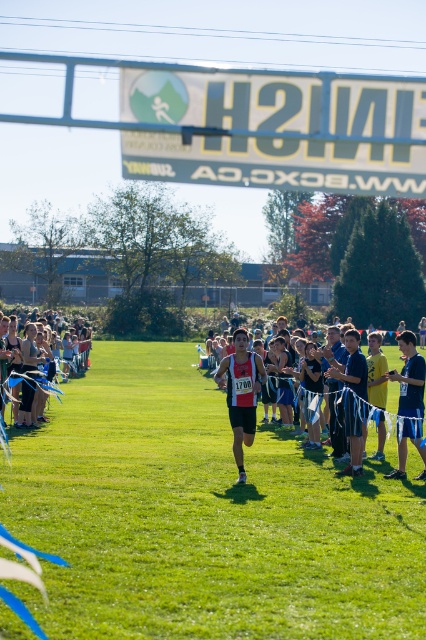
The image size is (426, 640). Describe the element at coordinates (241, 394) in the screenshot. I see `matte black running suit at center` at that location.

Is matte black running suit at center positioned behind blue athletic shorts at right?

No, it is not.

Is point (253, 369) less distant than point (400, 468)?

Yes, it is.

Identify the location of matte black running suit at center. (241, 394).

Is point (198, 77) positioned in front of point (233, 419)?

Yes.

From the picture: Is white plastic banner at upper center wider than matte black running suit at center?

Indeed, white plastic banner at upper center has a greater width compared to matte black running suit at center.

Does point (416, 106) come behind point (253, 358)?

No, it is not.

Where is `white plastic banner at upper center`? white plastic banner at upper center is located at coordinates (276, 131).

Is black fabric running suit at center thinner than matte black running suit at center?

Yes, black fabric running suit at center is thinner than matte black running suit at center.

Can you confirm if black fabric running suit at center is positioned below matte black running suit at center?

Yes, black fabric running suit at center is below matte black running suit at center.

Does point (356, 438) lie in front of point (233, 422)?

No.

The height and width of the screenshot is (640, 426). I want to click on black fabric running suit at center, so click(353, 400).